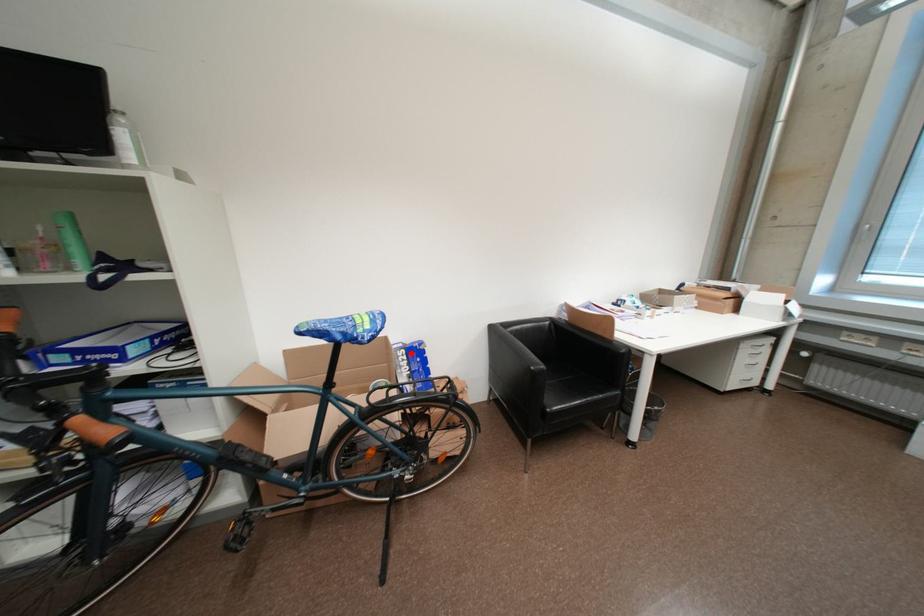
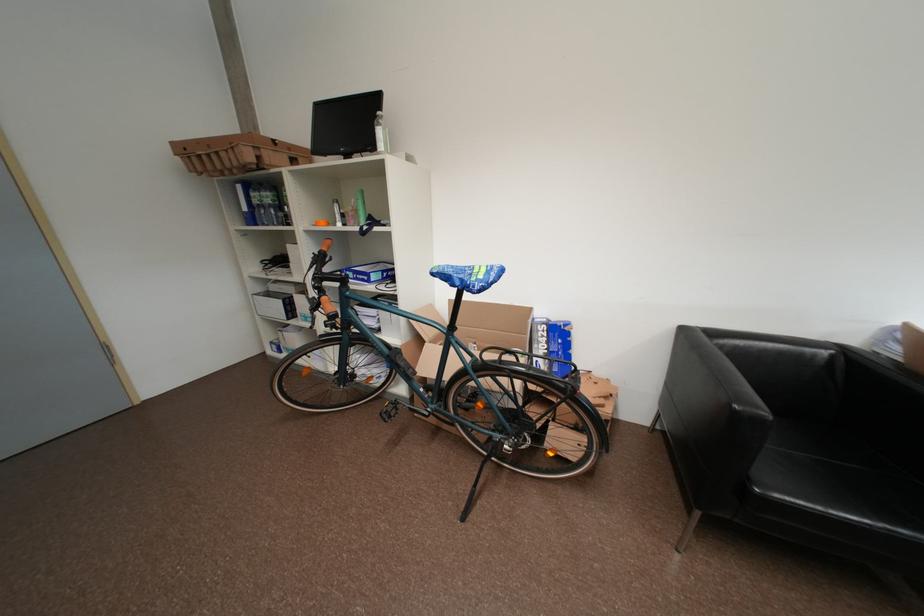
Find the pixel in the second image that matches the highlighted location in the first image.

(553, 329)